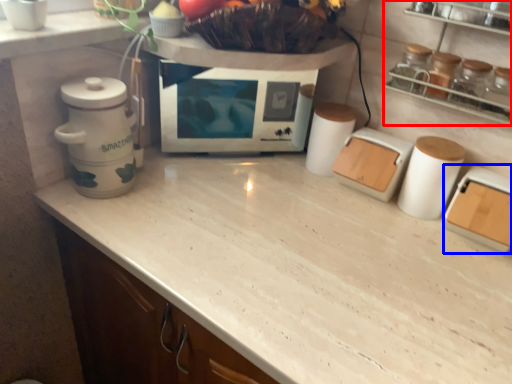
Question: Which object appears farthest to the camera in this image, shelf (highlighted by a red box) or kitchen appliance (highlighted by a blue box)?

Choices:
 (A) shelf
 (B) kitchen appliance

Answer: (B)